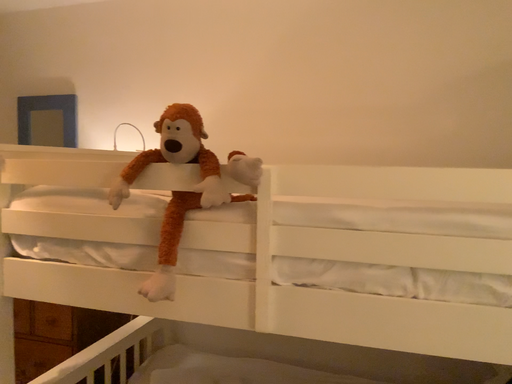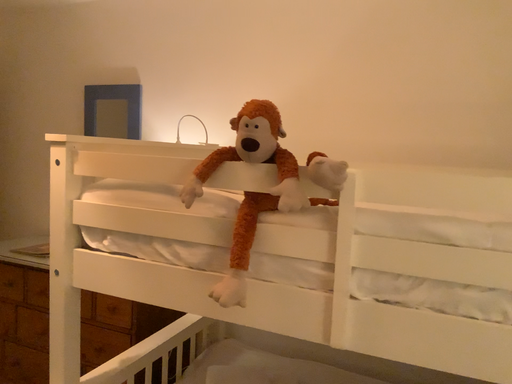
Question: How did the camera likely rotate when shooting the video?

Choices:
 (A) rotated right
 (B) rotated left

Answer: (B)